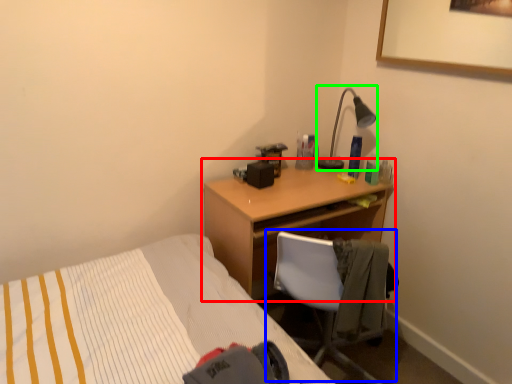
Question: Based on their relative distances, which object is nearer to desk (highlighted by a red box)? Choose from chair (highlighted by a blue box) and lamp (highlighted by a green box).

Choices:
 (A) chair
 (B) lamp

Answer: (A)